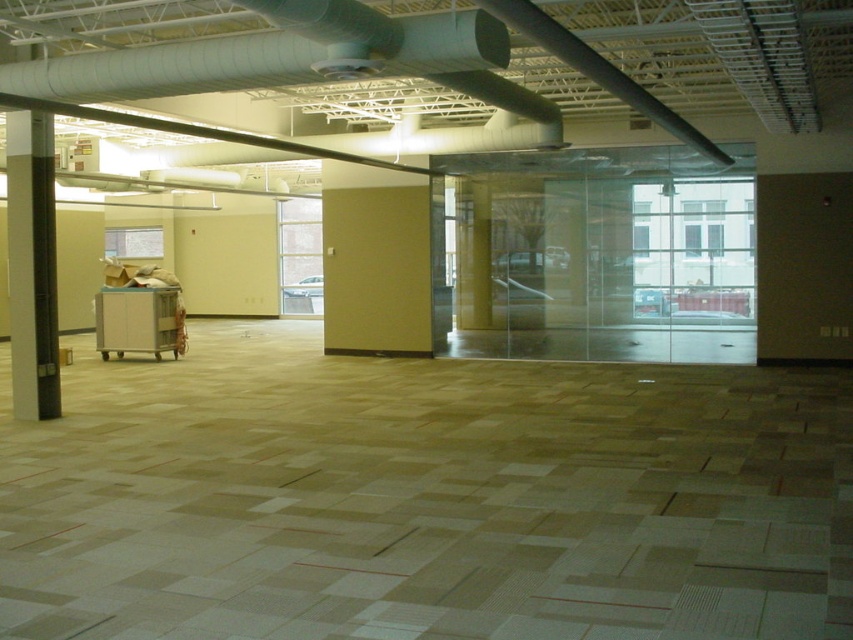
Consider the image. You are standing in the middle of the construction area and want to move towards the windows. The beige matte wall at center and the white glossy pillar at left are in your path. Which direction should you move to avoid them?

To avoid the beige matte wall at center and the white glossy pillar at left, you should move to the right since the beige matte wall at center is to the right of the white glossy pillar at left, so moving right would take you away from both objects towards the windows.

In the scene shown: You are an inspector checking the construction site. You notice the white glossy pillar at left and the beige matte wall at center. Which object is closer to you from your current position?

The beige matte wall at center is closer to you because the white glossy pillar at left is behind it.

You are an interior designer assessing the space. You notice the beige matte wall at center and the white glossy pillar at left. Which of these two elements has a greater vertical dimension?

The beige matte wall at center has a greater height compared to the white glossy pillar at left, so the beige matte wall at center has a greater vertical dimension.